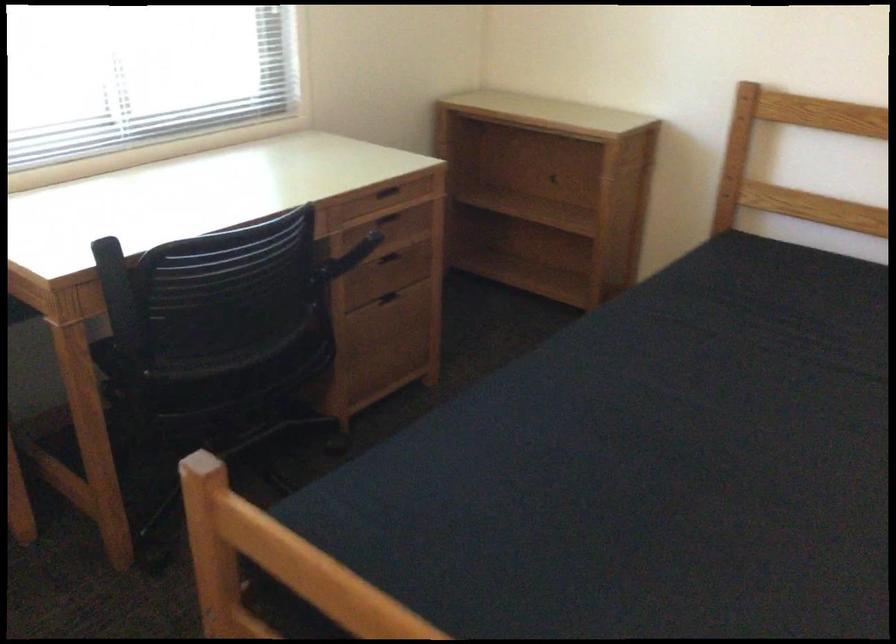
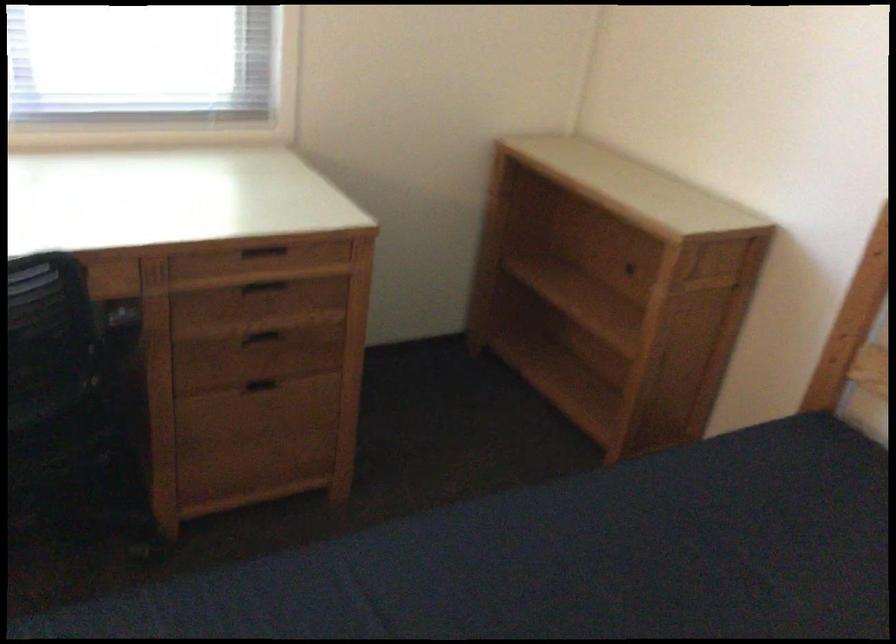
Find the pixel in the second image that matches point 366,265 in the first image.

(264, 333)